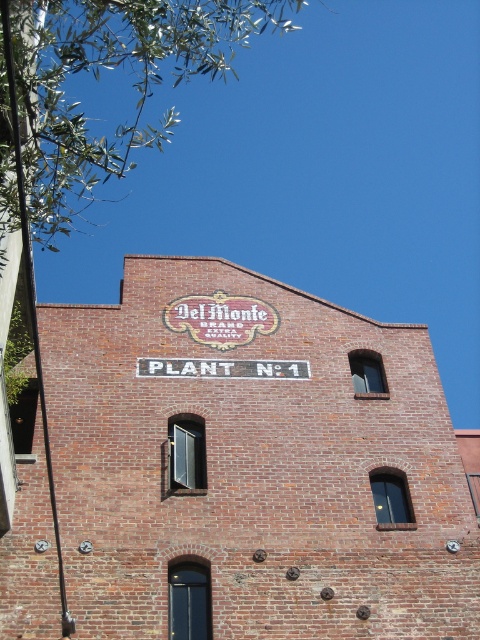
Which of these two, green leafy branches at upper left or black painted sign at center, stands taller?

green leafy branches at upper left is taller.

Based on the photo, who is more distant from viewer, (239, 33) or (148, 360)?

The point (239, 33) is more distant.

The width and height of the screenshot is (480, 640). I want to click on green leafy branches at upper left, so click(x=97, y=77).